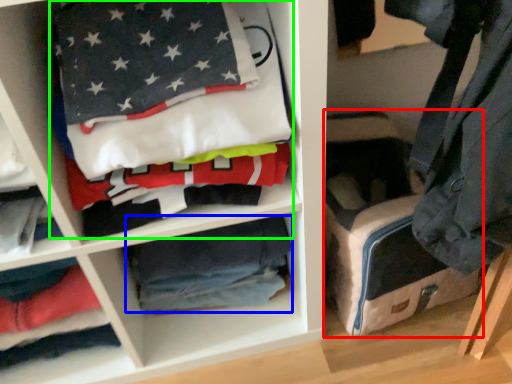
Question: Which object is the closest to the pack (highlighted by a red box)? Choose among these: material (highlighted by a blue box) or laundry (highlighted by a green box).

Choices:
 (A) material
 (B) laundry

Answer: (A)